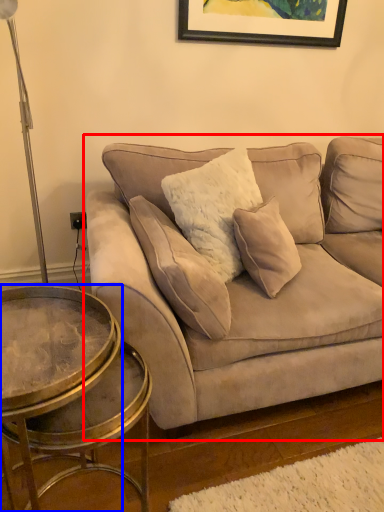
Question: Which point is further to the camera, studio couch (highlighted by a red box) or coffee table (highlighted by a blue box)?

Choices:
 (A) studio couch
 (B) coffee table

Answer: (A)